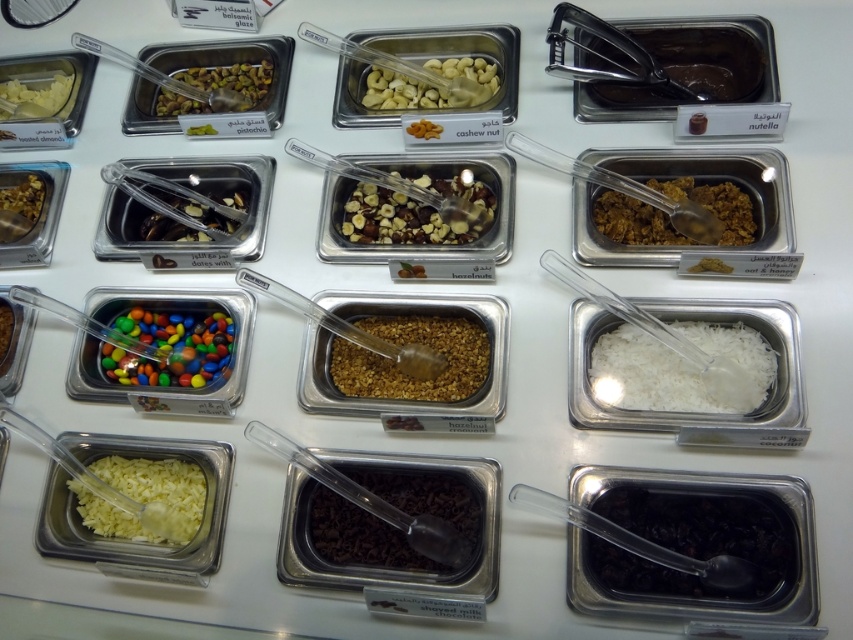
Question: Can you confirm if dark glossy chocolate at bottom right is positioned to the left of dark chocolate spread at upper right?

Choices:
 (A) yes
 (B) no

Answer: (A)

Question: Among these points, which one is nearest to the camera?

Choices:
 (A) (173, 195)
 (B) (425, 212)

Answer: (B)

Question: Which of these objects is positioned closest to the white creamy cheese at upper left?

Choices:
 (A) dark chocolate spread at upper right
 (B) dark chocolate chips at center
 (C) shiny hazelnut mix at center
 (D) dark glossy chocolate at bottom right

Answer: (C)

Question: Does white creamy rice at bottom right appear on the right side of brown granular nuts at center?

Choices:
 (A) yes
 (B) no

Answer: (A)

Question: Does dark chocolate chips at center appear on the left side of matte brown nuts at upper left?

Choices:
 (A) yes
 (B) no

Answer: (B)

Question: Which of these objects is positioned closest to the white creamy rice at bottom right?

Choices:
 (A) brown granular nuts at center
 (B) multicolored candy at center left

Answer: (A)